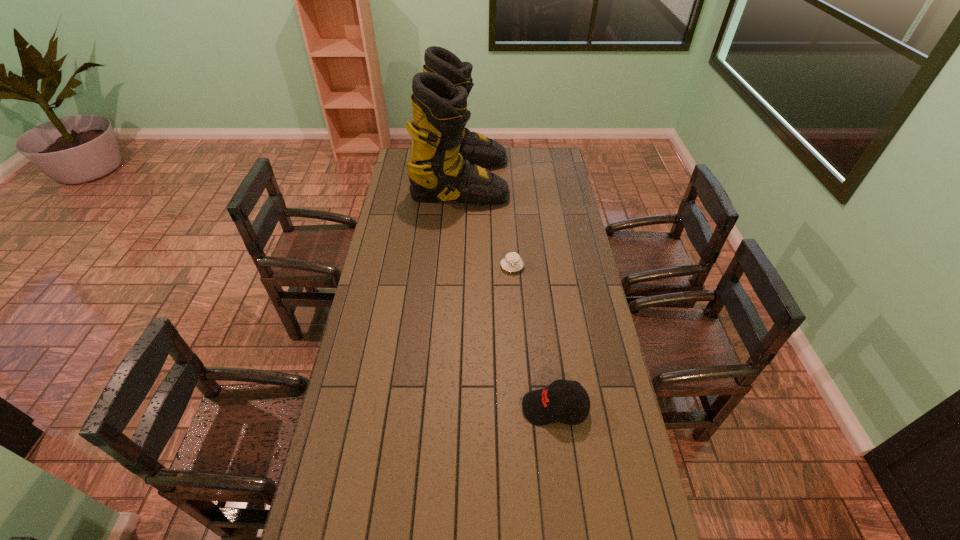
You are a GUI agent. You are given a task and a screenshot of the screen. Output one action in this format:
    pyautogui.click(x=<x>, y=<y>)
    Task: Click on the vacant space in between the second shortest object and the teacup
    
    Given the screenshot: What is the action you would take?
    pyautogui.click(x=534, y=337)

Locate an element on the screen. free space between the teacup and the second shortest object is located at coordinates (534, 337).

Identify the location of free space between the nearest object and the teacup. This screenshot has height=540, width=960. (534, 337).

Find the location of `vacant space that is in between the second tallest object and the second farthest object`. vacant space that is in between the second tallest object and the second farthest object is located at coordinates (534, 337).

Where is `the closest object to the teacup`? The height and width of the screenshot is (540, 960). the closest object to the teacup is located at coordinates (447, 162).

Where is `object that is the nearest to the tallest object`? The width and height of the screenshot is (960, 540). object that is the nearest to the tallest object is located at coordinates (512, 262).